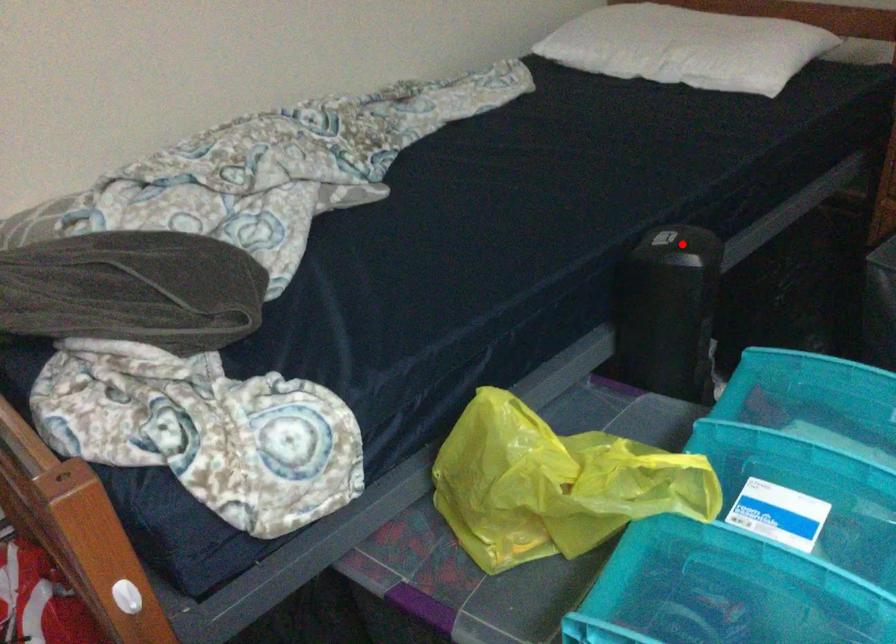
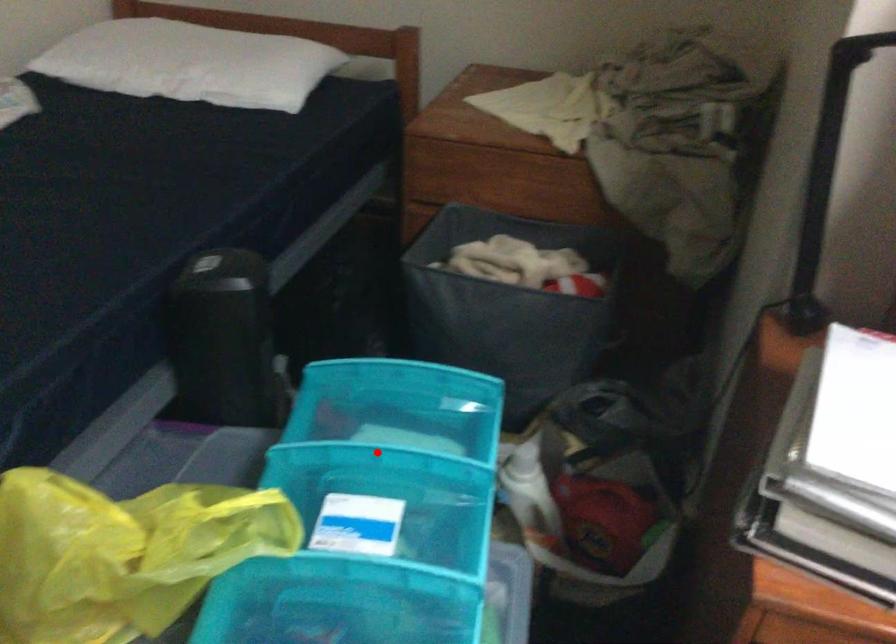
I am providing you with two images of the same scene from different viewpoints. A red point is marked on the first image and another point is marked on the second image. Are the points marked in image1 and image2 representing the same 3D position?

No